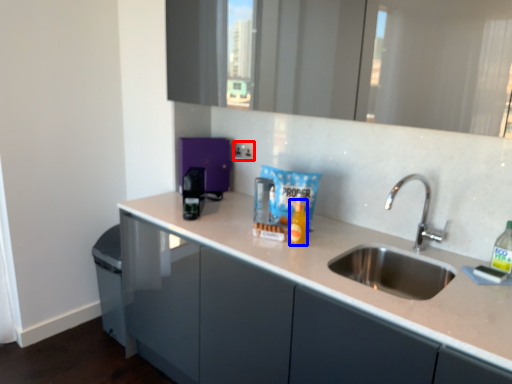
Question: Among these objects, which one is nearest to the camera, electric outlet (highlighted by a red box) or bottle (highlighted by a blue box)?

Choices:
 (A) electric outlet
 (B) bottle

Answer: (B)